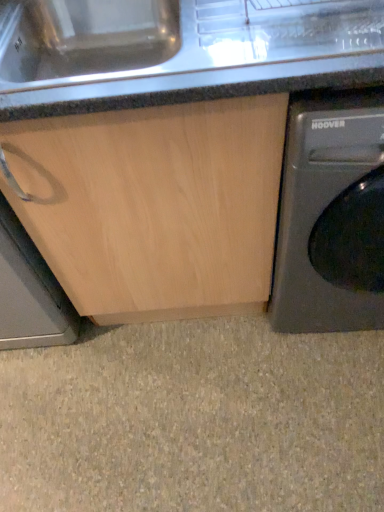
Question: Is granite countertop at center positioned beyond the bounds of metallic gray washing machine at right?

Choices:
 (A) yes
 (B) no

Answer: (A)

Question: Considering the relative sizes of granite countertop at center and metallic gray washing machine at right in the image provided, is granite countertop at center thinner than metallic gray washing machine at right?

Choices:
 (A) yes
 (B) no

Answer: (A)

Question: Is granite countertop at center touching metallic gray washing machine at right?

Choices:
 (A) no
 (B) yes

Answer: (A)

Question: Does granite countertop at center have a lesser height compared to metallic gray washing machine at right?

Choices:
 (A) no
 (B) yes

Answer: (B)

Question: From the image's perspective, does granite countertop at center appear higher than metallic gray washing machine at right?

Choices:
 (A) yes
 (B) no

Answer: (A)

Question: Could you tell me if granite countertop at center is turned towards metallic gray washing machine at right?

Choices:
 (A) no
 (B) yes

Answer: (A)

Question: Is granite countertop at center surrounded by beige wood cabinet at lower left?

Choices:
 (A) yes
 (B) no

Answer: (B)

Question: Can you confirm if beige wood cabinet at lower left is thinner than granite countertop at center?

Choices:
 (A) yes
 (B) no

Answer: (B)

Question: Is beige wood cabinet at lower left positioned far away from granite countertop at center?

Choices:
 (A) yes
 (B) no

Answer: (B)

Question: Are beige wood cabinet at lower left and granite countertop at center making contact?

Choices:
 (A) no
 (B) yes

Answer: (A)

Question: Can you confirm if beige wood cabinet at lower left is positioned to the right of granite countertop at center?

Choices:
 (A) no
 (B) yes

Answer: (A)

Question: From the image's perspective, is beige wood cabinet at lower left located above granite countertop at center?

Choices:
 (A) yes
 (B) no

Answer: (B)

Question: Does metallic gray washing machine at right have a larger size compared to beige wood cabinet at lower left?

Choices:
 (A) yes
 (B) no

Answer: (A)